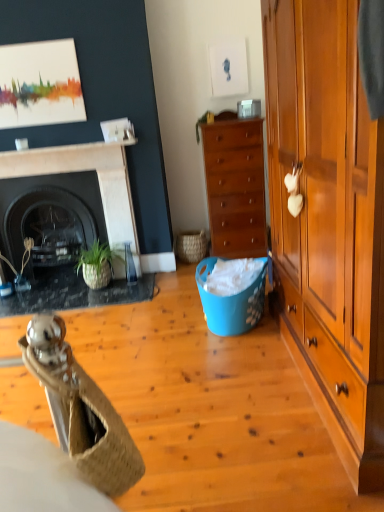
Question: Considering the positions of wooden cabinet at right and satin silver phone at upper center in the image, is wooden cabinet at right wider or thinner than satin silver phone at upper center?

Choices:
 (A) wide
 (B) thin

Answer: (A)

Question: From their relative heights in the image, would you say wooden cabinet at right is taller or shorter than satin silver phone at upper center?

Choices:
 (A) short
 (B) tall

Answer: (B)

Question: Estimate the real-world distances between objects in this image. Which object is closer to the blue plastic laundry basket at center?

Choices:
 (A) satin silver phone at upper center
 (B) green leafy plant at upper center
 (C) woven brown picnic basket at center
 (D) woven straw chair at lower left
 (E) matte white coffee cup at upper left

Answer: (C)

Question: Based on their relative distances, which object is farther from the matte black fireplace at left?

Choices:
 (A) green leafy plant at upper center
 (B) woven straw chair at lower left
 (C) black glossy fireplace at left, which is counted as the 2th fireplace, starting from the front
 (D) wooden cabinet at right
 (E) black marble fireplace at left, the second fireplace from the back

Answer: (B)